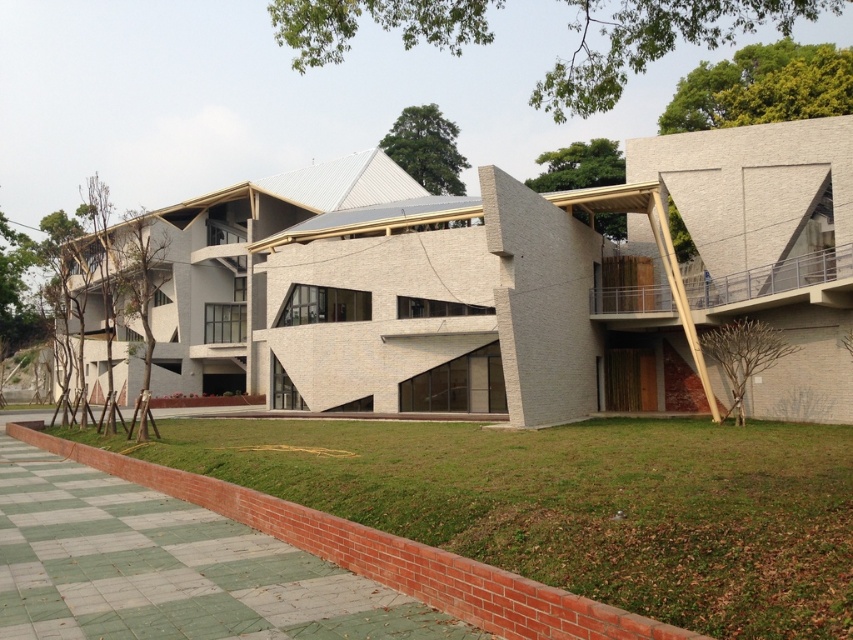
Who is positioned more to the left, white textured building at center or green grass at lower left?

From the viewer's perspective, white textured building at center appears more on the left side.

Is white textured building at center taller than green grass at lower left?

Correct, white textured building at center is much taller as green grass at lower left.

Where is `white textured building at center`? The width and height of the screenshot is (853, 640). white textured building at center is located at coordinates (531, 288).

The image size is (853, 640). What are the coordinates of `white textured building at center` in the screenshot? It's located at pyautogui.click(x=531, y=288).